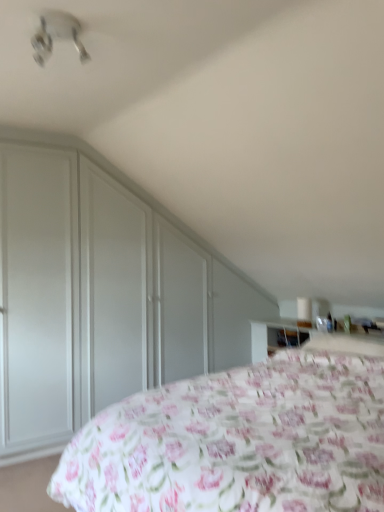
Question: Should I look upward or downward to see white plastic fan at upper left?

Choices:
 (A) up
 (B) down

Answer: (A)

Question: Is floral fabric bed at lower right further to camera compared to matte white dresser at left?

Choices:
 (A) yes
 (B) no

Answer: (B)

Question: Could you tell me if floral fabric bed at lower right is turned towards matte white dresser at left?

Choices:
 (A) no
 (B) yes

Answer: (A)

Question: Considering the relative sizes of floral fabric bed at lower right and matte white dresser at left in the image provided, is floral fabric bed at lower right shorter than matte white dresser at left?

Choices:
 (A) no
 (B) yes

Answer: (B)

Question: From a real-world perspective, does floral fabric bed at lower right stand above matte white dresser at left?

Choices:
 (A) no
 (B) yes

Answer: (A)

Question: Is matte white dresser at left completely or partially inside floral fabric bed at lower right?

Choices:
 (A) no
 (B) yes

Answer: (A)

Question: Does floral fabric bed at lower right have a lesser width compared to matte white dresser at left?

Choices:
 (A) no
 (B) yes

Answer: (A)

Question: Is floral fabric bed at lower right with white plastic fan at upper left?

Choices:
 (A) yes
 (B) no

Answer: (B)

Question: Is floral fabric bed at lower right completely or partially outside of white plastic fan at upper left?

Choices:
 (A) yes
 (B) no

Answer: (A)

Question: Could you tell me if floral fabric bed at lower right is turned towards white plastic fan at upper left?

Choices:
 (A) yes
 (B) no

Answer: (B)

Question: Is floral fabric bed at lower right to the left of white plastic fan at upper left from the viewer's perspective?

Choices:
 (A) no
 (B) yes

Answer: (A)

Question: Is floral fabric bed at lower right behind white plastic fan at upper left?

Choices:
 (A) yes
 (B) no

Answer: (B)

Question: Considering the relative sizes of floral fabric bed at lower right and white plastic fan at upper left in the image provided, is floral fabric bed at lower right thinner than white plastic fan at upper left?

Choices:
 (A) no
 (B) yes

Answer: (A)

Question: Can you confirm if matte white dresser at left is shorter than floral fabric bed at lower right?

Choices:
 (A) no
 (B) yes

Answer: (A)